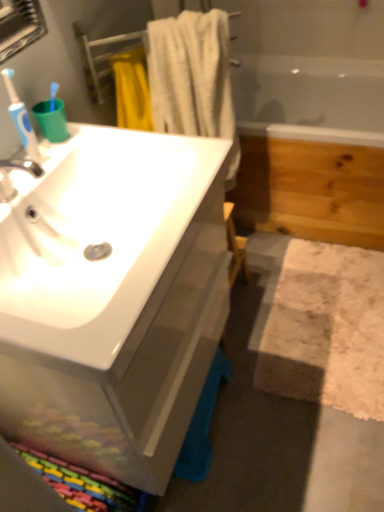
Question: Does white textured bath mat at lower right come in front of blue plastic toothbrush at left?

Choices:
 (A) no
 (B) yes

Answer: (A)

Question: From a real-world perspective, is white textured bath mat at lower right positioned over blue plastic toothbrush at left based on gravity?

Choices:
 (A) yes
 (B) no

Answer: (B)

Question: From the image's perspective, does white textured bath mat at lower right appear lower than blue plastic toothbrush at left?

Choices:
 (A) yes
 (B) no

Answer: (A)

Question: Could you tell me if white textured bath mat at lower right is facing blue plastic toothbrush at left?

Choices:
 (A) yes
 (B) no

Answer: (B)

Question: From the image's perspective, is white textured bath mat at lower right on blue plastic toothbrush at left?

Choices:
 (A) yes
 (B) no

Answer: (B)

Question: From the image's perspective, is white cotton towel at upper center above or below white textured bath mat at lower right?

Choices:
 (A) below
 (B) above

Answer: (B)

Question: Is white cotton towel at upper center spatially inside white textured bath mat at lower right, or outside of it?

Choices:
 (A) outside
 (B) inside

Answer: (A)

Question: From a real-world perspective, is white cotton towel at upper center above or below white textured bath mat at lower right?

Choices:
 (A) below
 (B) above

Answer: (B)

Question: Based on their sizes in the image, would you say white cotton towel at upper center is bigger or smaller than white textured bath mat at lower right?

Choices:
 (A) big
 (B) small

Answer: (A)

Question: Is wooden bathtub at right to the left or to the right of white glossy sink at left in the image?

Choices:
 (A) left
 (B) right

Answer: (B)

Question: Does point (326, 135) appear closer or farther from the camera than point (77, 132)?

Choices:
 (A) closer
 (B) farther

Answer: (B)

Question: Is wooden bathtub at right inside or outside of white glossy sink at left?

Choices:
 (A) outside
 (B) inside

Answer: (A)

Question: Is wooden bathtub at right wider or thinner than white glossy sink at left?

Choices:
 (A) thin
 (B) wide

Answer: (B)

Question: Would you say white cotton towel at upper center is to the left or to the right of wooden bathtub at right in the picture?

Choices:
 (A) right
 (B) left

Answer: (B)

Question: Which is correct: white cotton towel at upper center is inside wooden bathtub at right, or outside of it?

Choices:
 (A) outside
 (B) inside

Answer: (A)